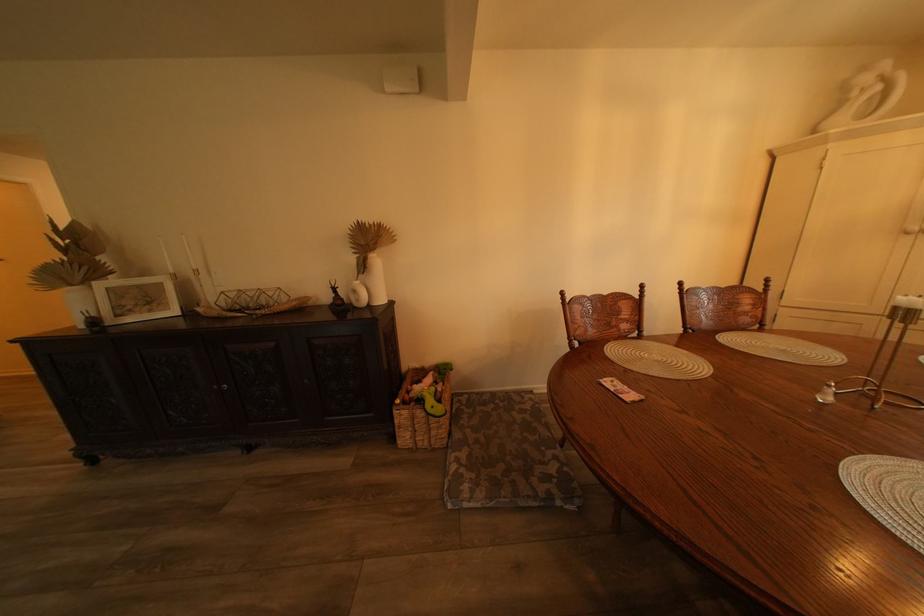
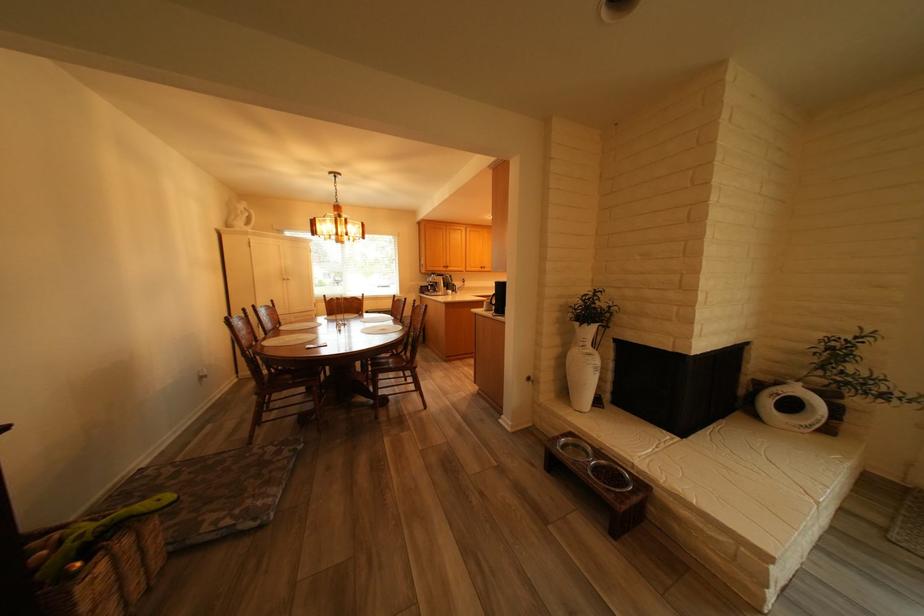
The point at (446, 408) is marked in the first image. Where is the corresponding point in the second image?

(174, 501)